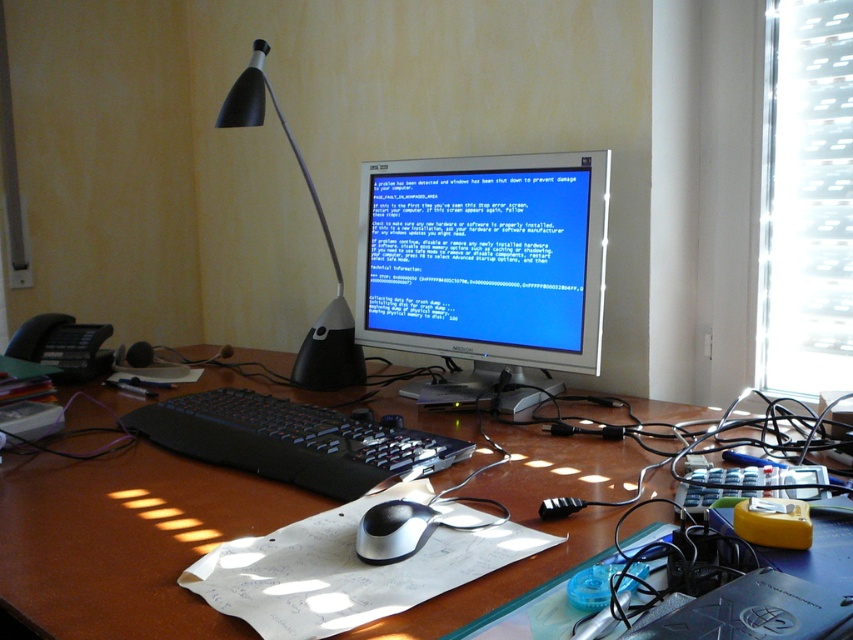
Question: Which of these objects is positioned farthest from the brown wooden desk at center?

Choices:
 (A) black plastic keyboard at center
 (B) black plastic desk lamp at upper center

Answer: (B)

Question: Estimate the real-world distances between objects in this image. Which object is closer to the sleek silver mouse at center?

Choices:
 (A) matte plastic monitor at center
 (B) black plastic keyboard at center
 (C) black plastic desk lamp at upper center
 (D) brown wooden desk at center

Answer: (B)

Question: Is the position of black plastic keyboard at center less distant than that of sleek silver mouse at center?

Choices:
 (A) no
 (B) yes

Answer: (A)

Question: Which object is the closest to the matte plastic monitor at center?

Choices:
 (A) black plastic desk lamp at upper center
 (B) brown wooden desk at center
 (C) black plastic keyboard at center
 (D) sleek silver mouse at center

Answer: (A)

Question: Is matte plastic monitor at center bigger than black plastic keyboard at center?

Choices:
 (A) yes
 (B) no

Answer: (A)

Question: Considering the relative positions of black plastic keyboard at center and black plastic desk lamp at upper center in the image provided, where is black plastic keyboard at center located with respect to black plastic desk lamp at upper center?

Choices:
 (A) left
 (B) right

Answer: (B)